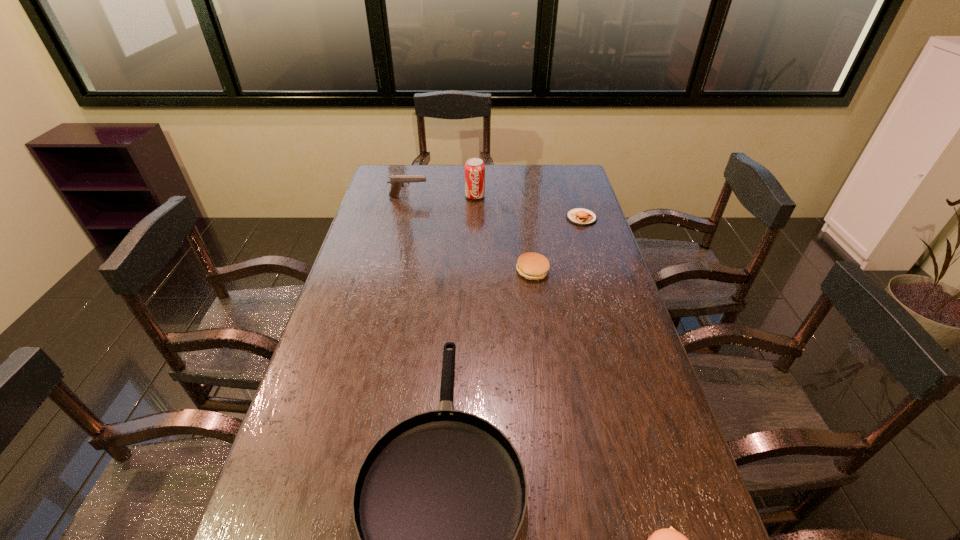
Find the location of a particular element. This screenshot has width=960, height=540. object that stands as the third closest to the fourth object from left to right is located at coordinates (474, 168).

Identify the location of patty that can be found as the third closest to the fifth shortest object. The image size is (960, 540). coord(665,539).

The image size is (960, 540). In order to click on patty that is the second closest one to the third object from right to left in this screenshot , I will do `click(665, 539)`.

Identify the location of vacant space that satisfies the following two spatial constraints: 1. on the logo side of the soda can; 2. on the right side of the fourth nearest object. (474, 218).

You are a GUI agent. You are given a task and a screenshot of the screen. Output one action in this format:
    pyautogui.click(x=<x>, y=<y>)
    Task: Click on the free space that satisfies the following two spatial constraints: 1. on the logo side of the tallest object; 2. on the left side of the second farthest patty
    This screenshot has height=540, width=960.
    Given the screenshot: What is the action you would take?
    pyautogui.click(x=473, y=271)

Locate an element on the screen. The image size is (960, 540). vacant region that satisfies the following two spatial constraints: 1. at the barrel of the third nearest object; 2. on the left side of the second tallest object is located at coordinates (391, 271).

Identify the location of vacant space that satisfies the following two spatial constraints: 1. on the logo side of the fourth farthest object; 2. on the left side of the tallest object. The height and width of the screenshot is (540, 960). (473, 271).

Identify the location of free location that satisfies the following two spatial constraints: 1. at the barrel of the pistol; 2. on the left side of the third nearest object. The image size is (960, 540). (391, 271).